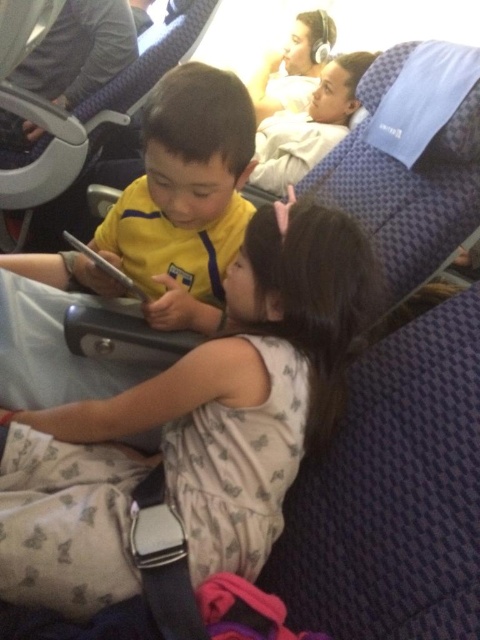
Can you confirm if light beige fabric dress at center is wider than yellow matte shirt at center?

Indeed, light beige fabric dress at center has a greater width compared to yellow matte shirt at center.

Which of these two, light beige fabric dress at center or yellow matte shirt at center, stands shorter?

yellow matte shirt at center

At what (x,y) coordinates should I click in order to perform the action: click on light beige fabric dress at center. Please return your answer as a coordinate pair (x, y). Looking at the image, I should click on (193, 424).

Which is behind, point (236, 502) or point (291, 65)?

Positioned behind is point (291, 65).

Who is more distant from viewer, (117,536) or (308,88)?

The point (308,88) is behind.

Find the location of a particular element. light beige fabric dress at center is located at coordinates (193, 424).

Is yellow matte shirt at center above matte white headphones at upper center?

No, yellow matte shirt at center is not above matte white headphones at upper center.

Does yellow matte shirt at center lie behind matte white headphones at upper center?

No, yellow matte shirt at center is closer to the viewer.

What do you see at coordinates (186, 196) in the screenshot?
I see `yellow matte shirt at center` at bounding box center [186, 196].

Identify the location of yellow matte shirt at center. This screenshot has width=480, height=640. (186, 196).